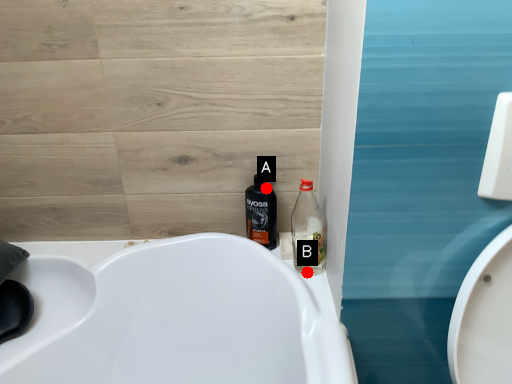
Question: Two points are circled on the image, labeled by A and B beside each circle. Which point appears closest to the camera in this image?

Choices:
 (A) A is closer
 (B) B is closer

Answer: (B)